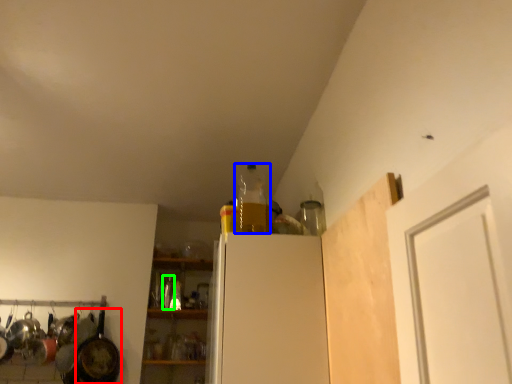
Question: Based on their relative distances, which object is farther from frying pan (highlighted by a red box)? Choose from bottle (highlighted by a blue box) and bottle (highlighted by a green box).

Choices:
 (A) bottle
 (B) bottle

Answer: (A)